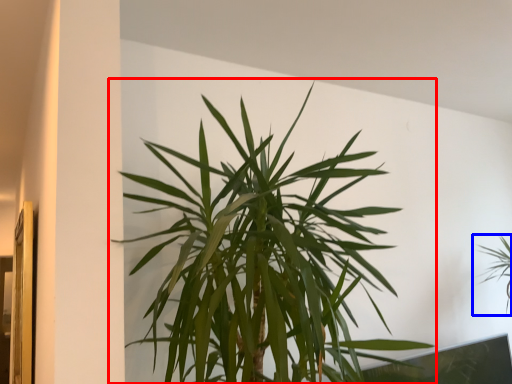
Question: Which point is further to the camera, houseplant (highlighted by a red box) or houseplant (highlighted by a blue box)?

Choices:
 (A) houseplant
 (B) houseplant

Answer: (B)